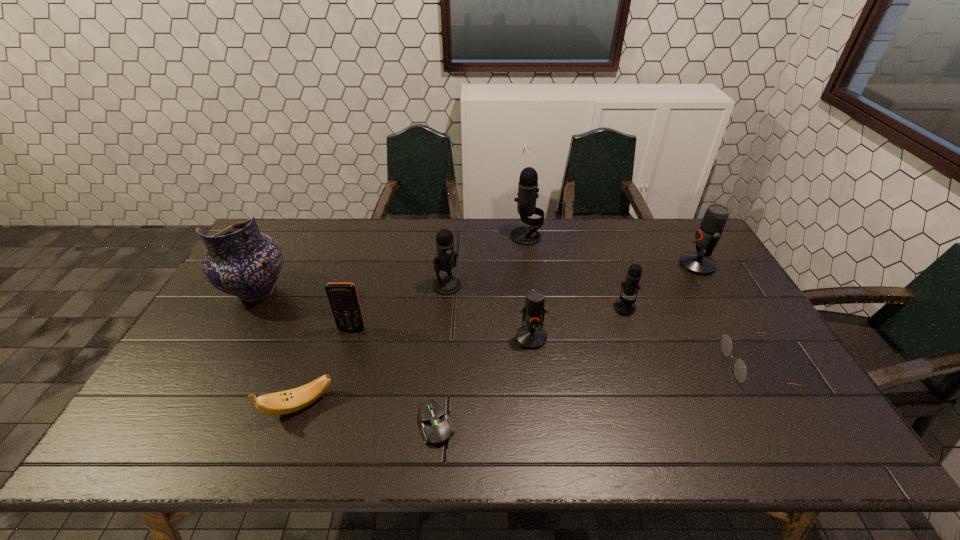
Where is `vacant space located on the temples of the second shortest object`? vacant space located on the temples of the second shortest object is located at coordinates (691, 365).

I want to click on vacant space located 0.060m on the temples of the second shortest object, so click(703, 365).

Find the location of `vacant space located on the right of the shortest object`. vacant space located on the right of the shortest object is located at coordinates (623, 424).

The height and width of the screenshot is (540, 960). I want to click on banana positioned at the near edge, so click(285, 402).

Find the location of a particular element. This screenshot has height=540, width=960. computer mouse located at the near edge is located at coordinates (436, 428).

Locate an element on the screen. object that is at the left edge is located at coordinates (240, 261).

Find the location of a particular element. The width and height of the screenshot is (960, 540). microphone at the right edge is located at coordinates (707, 237).

This screenshot has width=960, height=540. Identify the location of spectacles that is at the right edge. (740, 370).

Find the location of a particular element. object that is at the far right corner is located at coordinates (707, 237).

Find the location of `free region at the far edge of the desktop`. free region at the far edge of the desktop is located at coordinates (590, 220).